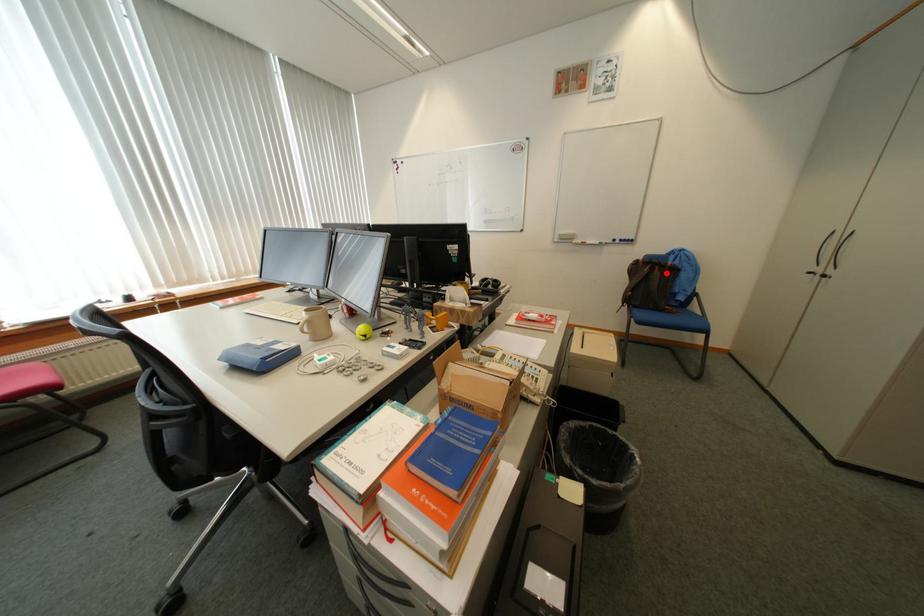
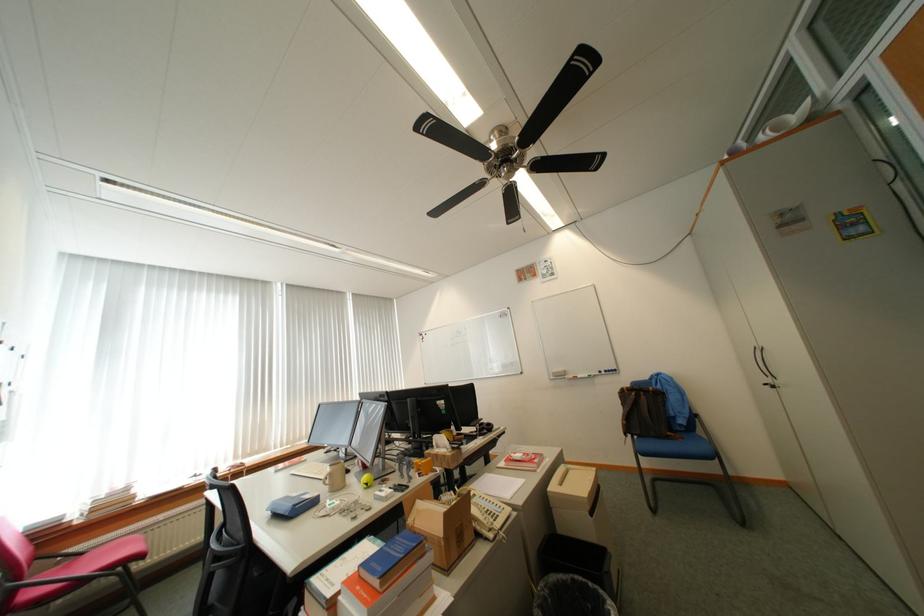
Question: A red point is marked in image1. In image2, is the corresponding 3D point closer to the camera or farther? Reply with the corresponding letter.

Choices:
 (A) The corresponding 3D point is closer.
 (B) The corresponding 3D point is farther.

Answer: (B)